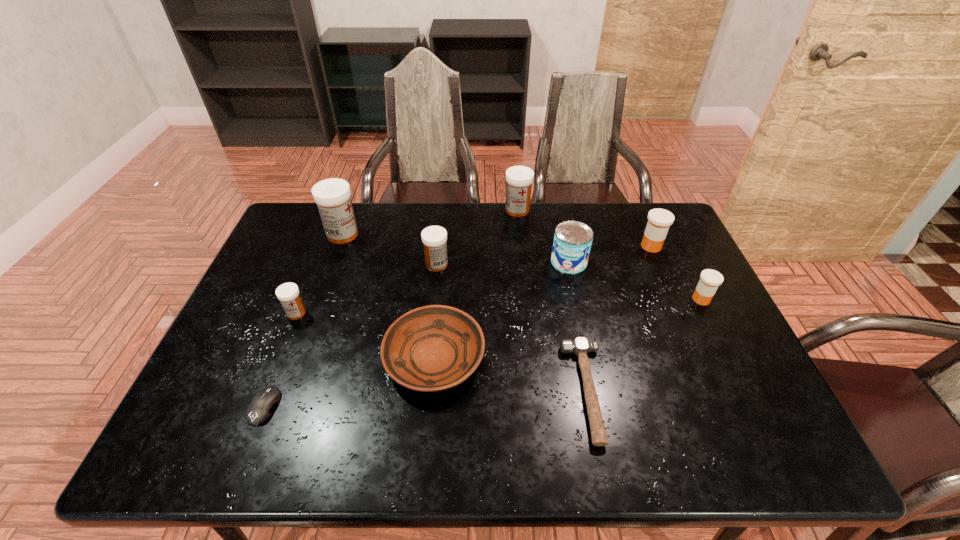
Locate an element on the screen. The height and width of the screenshot is (540, 960). the second farthest white medicine is located at coordinates (333, 196).

The height and width of the screenshot is (540, 960). I want to click on the tallest medicine, so click(x=333, y=196).

Image resolution: width=960 pixels, height=540 pixels. In order to click on the rightmost white medicine in this screenshot , I will do `click(519, 179)`.

At what (x,y) coordinates should I click in order to perform the action: click on the farthest white medicine. Please return your answer as a coordinate pair (x, y). Looking at the image, I should click on (519, 179).

Find the location of a particular element. Image resolution: width=960 pixels, height=540 pixels. the second object from right to left is located at coordinates (659, 220).

Where is `the left orange medicine`? This screenshot has width=960, height=540. the left orange medicine is located at coordinates (659, 220).

Identify the location of the second white medicine from right to left. (434, 238).

This screenshot has width=960, height=540. Identify the location of the fourth farthest medicine. (434, 238).

At what (x,y) coordinates should I click in order to perform the action: click on blue can. Please return your answer as a coordinate pair (x, y). The height and width of the screenshot is (540, 960). Looking at the image, I should click on (572, 242).

The width and height of the screenshot is (960, 540). I want to click on the smaller orange medicine, so click(710, 280).